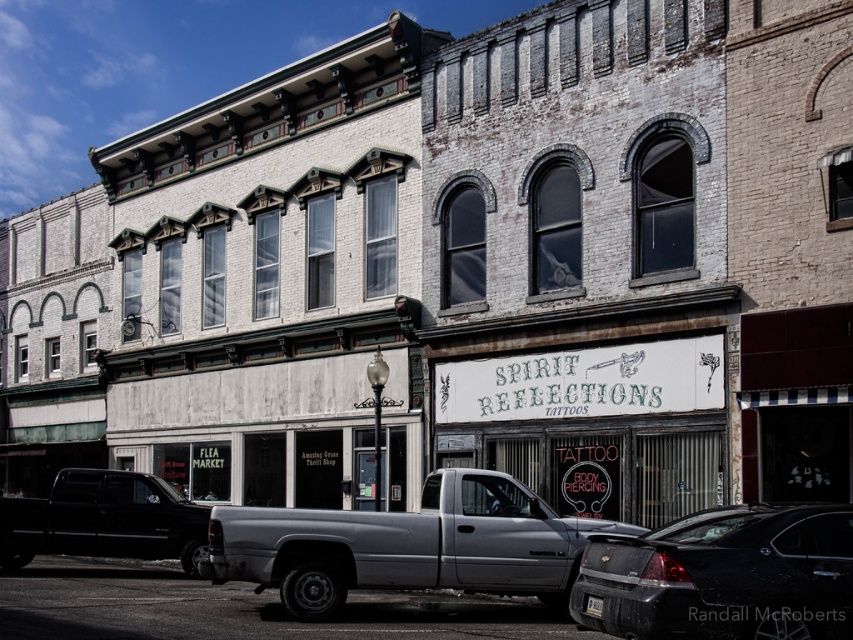
Is point (482, 493) more distant than point (715, 552)?

Yes, point (482, 493) is farther from viewer.

Is silver metallic truck at center behind black glossy sedan at lower right?

Yes, silver metallic truck at center is behind black glossy sedan at lower right.

Is point (251, 522) closer to viewer compared to point (718, 548)?

No, it is not.

Where is `silver metallic truck at center`? silver metallic truck at center is located at coordinates (405, 545).

Which of these two, silver metallic truck at center or matte black truck at lower left, stands taller?

With more height is matte black truck at lower left.

Is silver metallic truck at center to the right of matte black truck at lower left from the viewer's perspective?

Indeed, silver metallic truck at center is positioned on the right side of matte black truck at lower left.

Between point (223, 572) and point (131, 493), which one is positioned behind?

Positioned behind is point (131, 493).

Find the location of a particular element. The image size is (853, 640). silver metallic truck at center is located at coordinates (405, 545).

Is black glossy sedan at lower right to the right of matte black truck at lower left from the viewer's perspective?

Correct, you'll find black glossy sedan at lower right to the right of matte black truck at lower left.

Who is positioned more to the right, black glossy sedan at lower right or matte black truck at lower left?

From the viewer's perspective, black glossy sedan at lower right appears more on the right side.

Does point (813, 586) come farther from viewer compared to point (73, 554)?

No, (813, 586) is closer to viewer.

Identify the location of black glossy sedan at lower right. (723, 577).